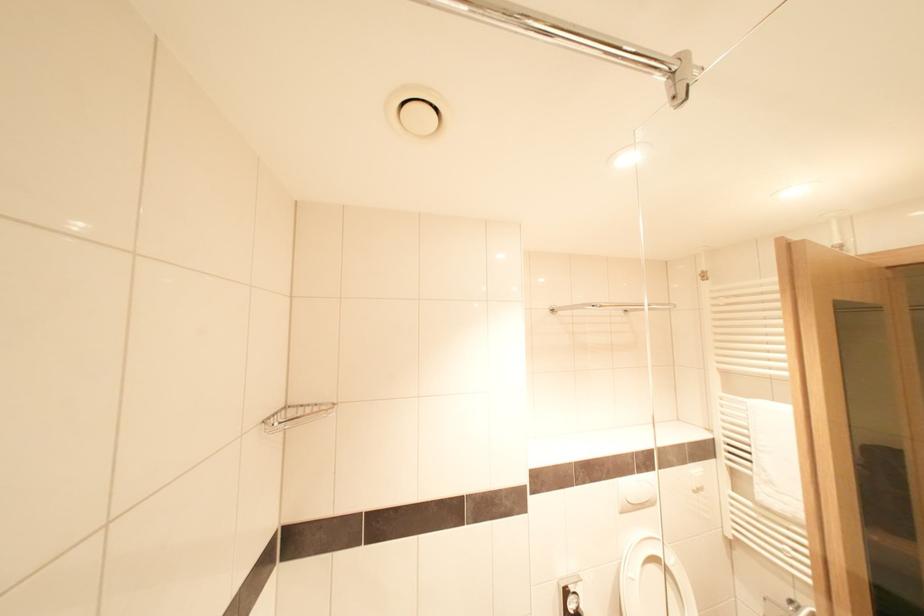
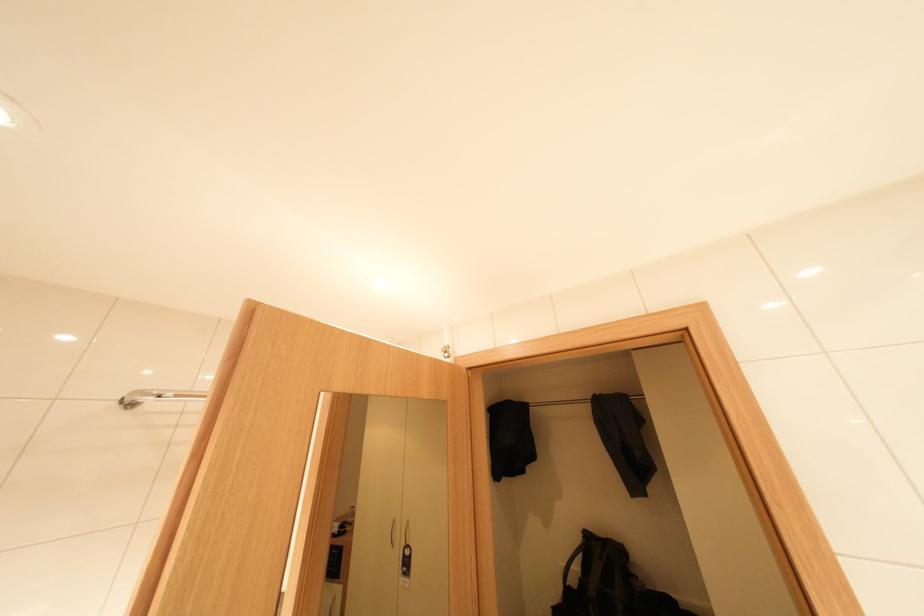
The point at [560,309] is marked in the first image. Where is the corresponding point in the second image?

(130, 399)